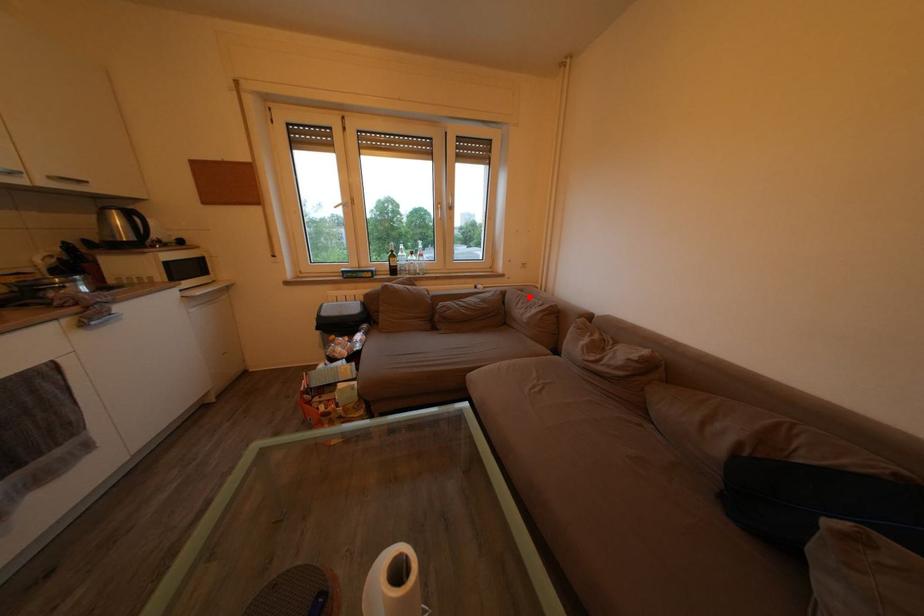
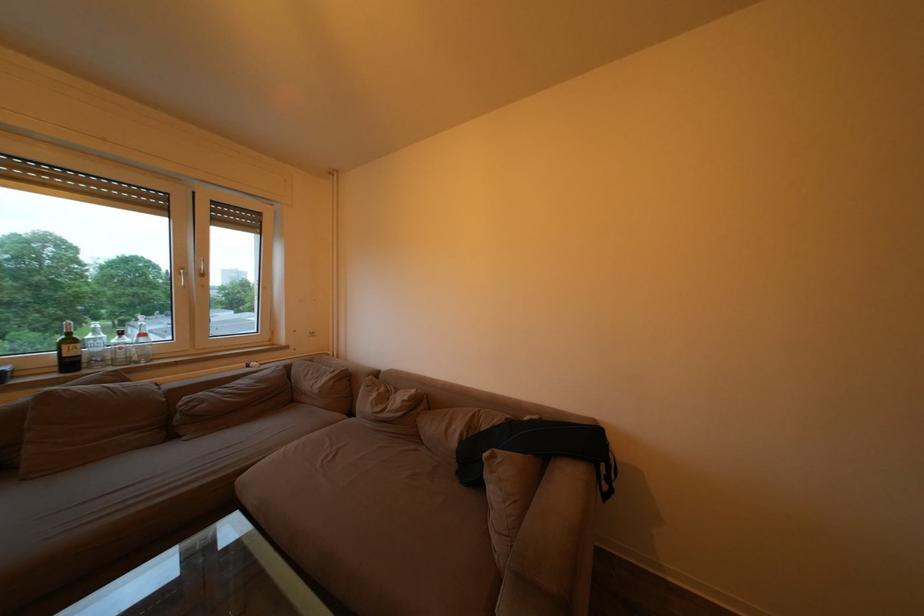
Question: I am providing you with two images of the same scene from different viewpoints. A red point is shown in image1. For the corresponding object point in image2, is it positioned nearer or farther from the camera?

Choices:
 (A) Nearer
 (B) Farther

Answer: (B)